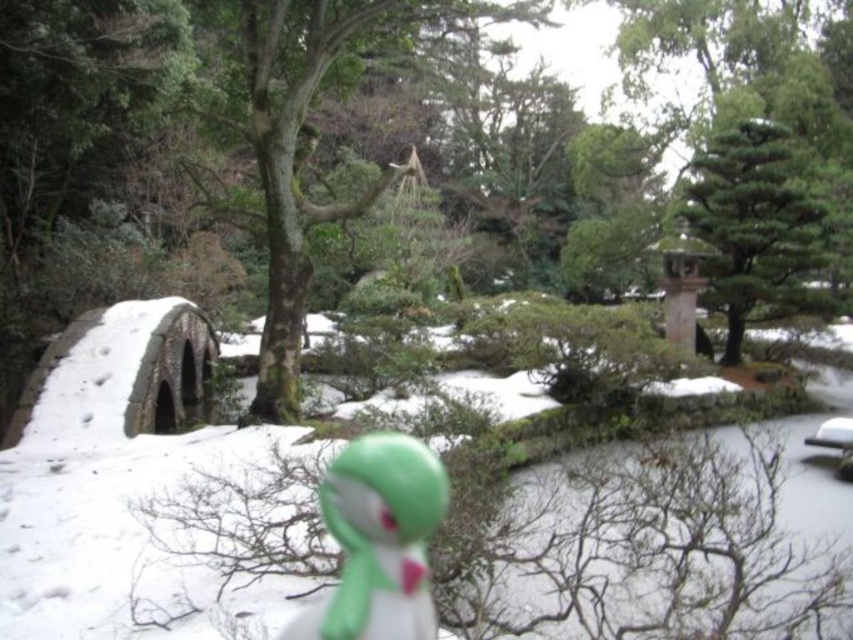
In the winter Japanese garden scene, there is a green mossy tree at center and a green textured tree at upper right. Which tree is positioned to the left when viewed from the stone bridge?

The green mossy tree at center is to the left of the green textured tree at upper right, so when viewed from the stone bridge, the green mossy tree at center is positioned to the left.

You are a visitor in the garden and want to take a photo of the green matte figurine at center without the green textured tree at upper right blocking it. How should you adjust your position?

Move closer to the green matte figurine at center so that the green textured tree at upper right is no longer in front of it. Since the green matte figurine at center is behind the green textured tree at upper right, moving closer would allow you to position yourself where the tree no longer obstructs the view of the figurine.